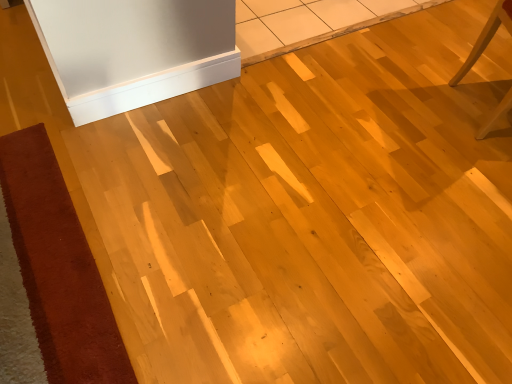
Where is `blank space to the left of light wood chair at right`? Image resolution: width=512 pixels, height=384 pixels. blank space to the left of light wood chair at right is located at coordinates (411, 121).